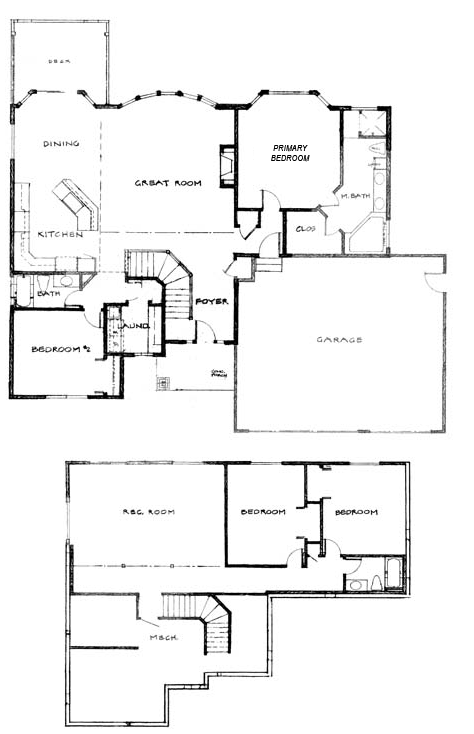
Identify the location of staircase. The image size is (474, 734). (216, 636), (173, 282).